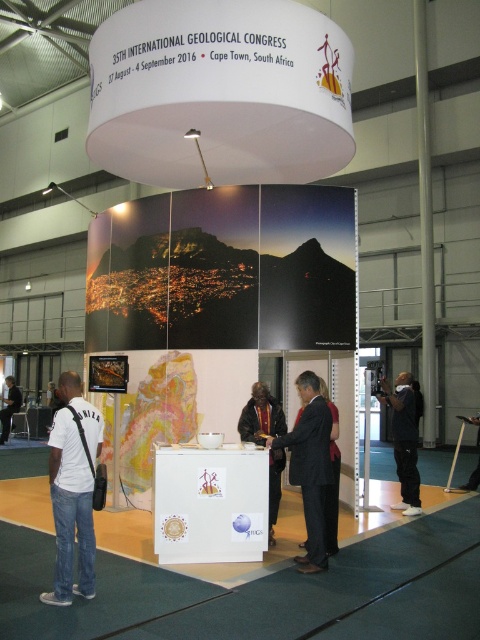
You are an attendee at the conference and need to decide which item to place in your bag. You have a dark suit at center and a white fabric bag at lower left. Which item can you place into the other without difficulty?

The white fabric bag at lower left can easily contain the dark suit at center since it is larger in size.